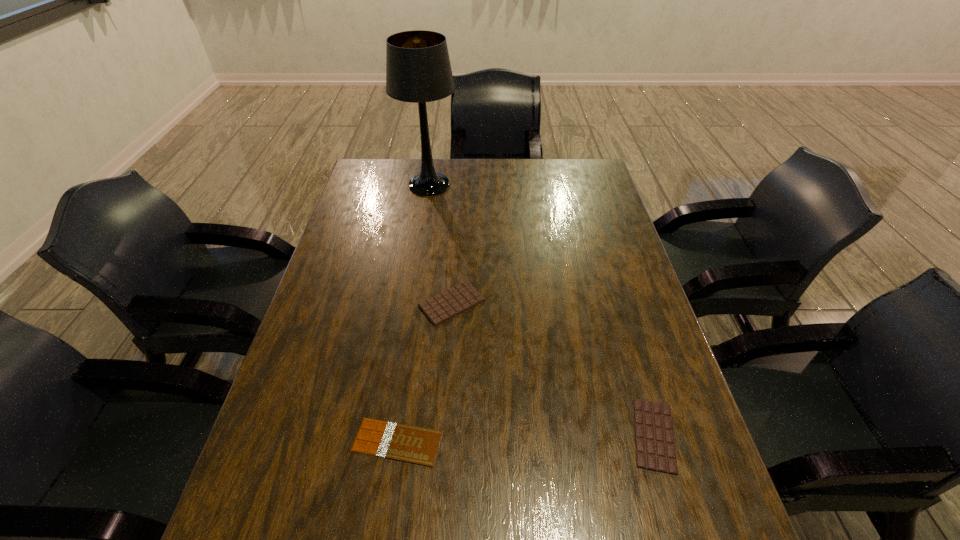
At what (x,y) coordinates should I click in order to perform the action: click on free space located on the right of the shortest object. Please return your answer as a coordinate pair (x, y). Image resolution: width=960 pixels, height=540 pixels. Looking at the image, I should click on (599, 442).

Find the location of `object positioned at the far edge`. object positioned at the far edge is located at coordinates (418, 70).

I want to click on object that is at the left edge, so click(418, 70).

The width and height of the screenshot is (960, 540). I want to click on object that is at the right edge, so click(655, 449).

This screenshot has height=540, width=960. I want to click on object located in the far left corner section of the desktop, so click(418, 70).

In the image, there is a desktop. Where is `vacant region at the far edge`? The width and height of the screenshot is (960, 540). vacant region at the far edge is located at coordinates (467, 185).

Identify the location of vacant space at the left edge of the desktop. The height and width of the screenshot is (540, 960). (350, 271).

In the image, there is a desktop. At what (x,y) coordinates should I click in order to perform the action: click on vacant space at the right edge. Please return your answer as a coordinate pair (x, y). Image resolution: width=960 pixels, height=540 pixels. Looking at the image, I should click on (587, 241).

Find the location of a particular element. free space at the far right corner is located at coordinates (570, 192).

Locate an element on the screen. vacant point located between the shortest chocolate bar and the table lamp is located at coordinates (414, 313).